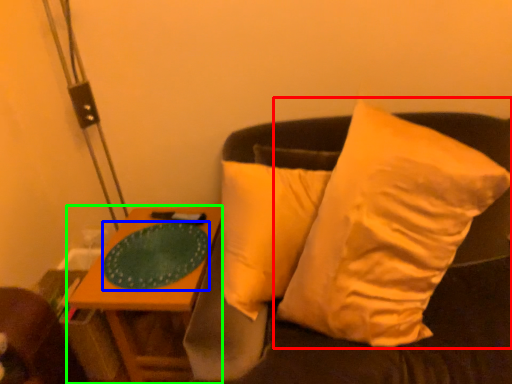
Question: Which object is the closest to the pillow (highlighted by a red box)? Choose among these: glass plate (highlighted by a blue box) or table (highlighted by a green box).

Choices:
 (A) glass plate
 (B) table

Answer: (A)